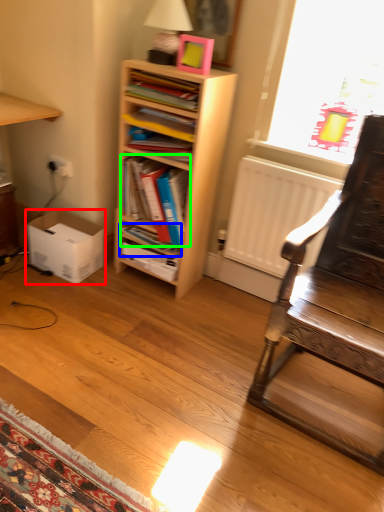
Question: Which is nearer to the box (highlighted by a red box)? book (highlighted by a blue box) or book (highlighted by a green box).

Choices:
 (A) book
 (B) book

Answer: (A)